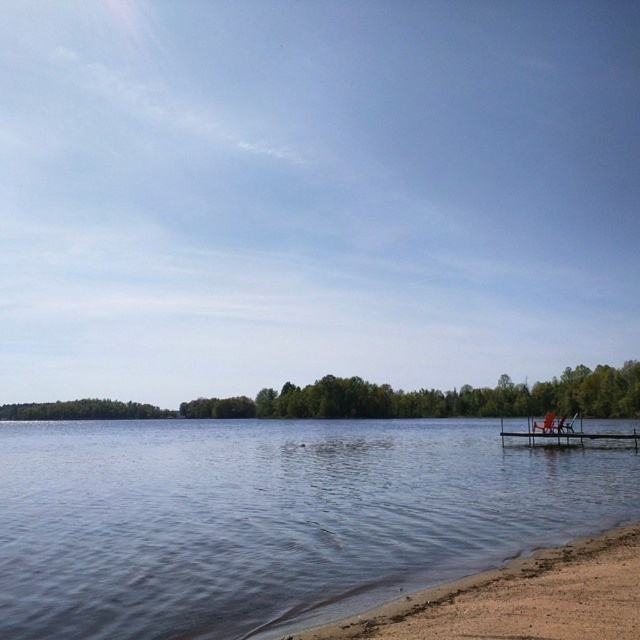
Can you confirm if brown wooden dock at lower right is bigger than wooden chair at lower right?

Yes, brown wooden dock at lower right is bigger than wooden chair at lower right.

Which is more to the left, brown wooden dock at lower right or wooden chair at lower right?

wooden chair at lower right

Does point (564, 435) lie in front of point (540, 424)?

Yes, point (564, 435) is in front of point (540, 424).

The image size is (640, 640). Identify the location of brown wooden dock at lower right. (566, 435).

Who is taller, brown sandy beach at lower right or wooden chair at lower right?

brown sandy beach at lower right

Who is more distant from viewer, (614, 588) or (532, 424)?

The point (532, 424) is more distant.

Who is more distant from viewer, (x=560, y=572) or (x=556, y=424)?

Point (x=556, y=424)

The image size is (640, 640). In order to click on brown sandy beach at lower right in this screenshot , I will do coord(518,598).

Can you confirm if brown sandy beach at lower right is positioned to the left of brown wooden dock at lower right?

Correct, you'll find brown sandy beach at lower right to the left of brown wooden dock at lower right.

Does point (529, 561) come closer to viewer compared to point (531, 445)?

Yes.

Is point (536, 557) positioned behind point (634, 445)?

No.

Locate an element on the screen. brown sandy beach at lower right is located at coordinates (518, 598).